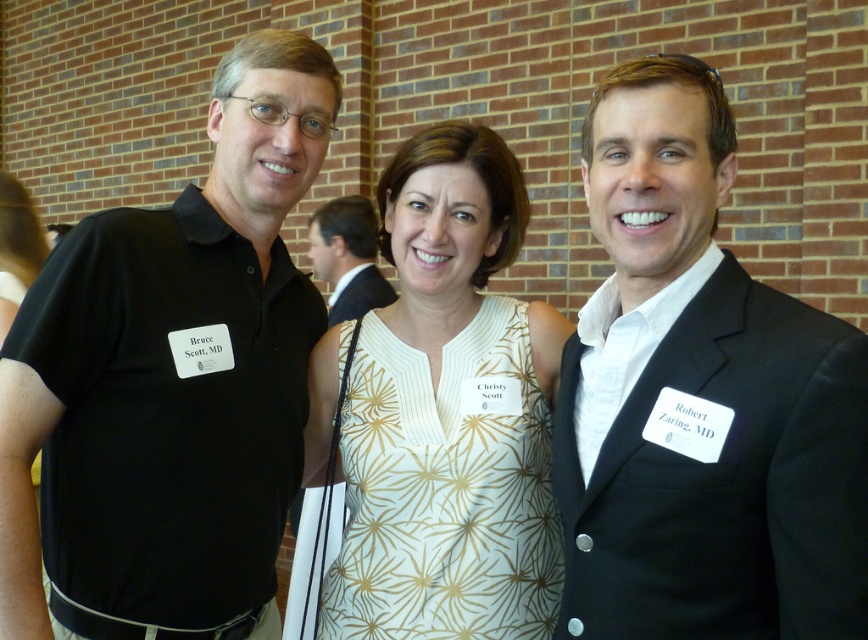
Is point (161, 566) positioned before point (404, 464)?

Yes.

You are a GUI agent. You are given a task and a screenshot of the screen. Output one action in this format:
    pyautogui.click(x=<x>, y=<y>)
    Task: Click on the black matte shirt at left
    
    Given the screenshot: What is the action you would take?
    pyautogui.click(x=169, y=381)

Based on the photo, is white textured dress at center above matte black shirt at center?

No.

Is point (400, 609) farther from camera compared to point (340, 232)?

That is False.

Where is `white textured dress at center`? The width and height of the screenshot is (868, 640). white textured dress at center is located at coordinates (444, 412).

From the picture: Who is higher up, black matte shirt at left or black suit at right?

black matte shirt at left is higher up.

Is black matte shirt at left taller than black suit at right?

Yes, black matte shirt at left is taller than black suit at right.

Does point (252, 109) come closer to viewer compared to point (832, 385)?

No, (252, 109) is behind (832, 385).

Image resolution: width=868 pixels, height=640 pixels. Identify the location of black matte shirt at left. (169, 381).